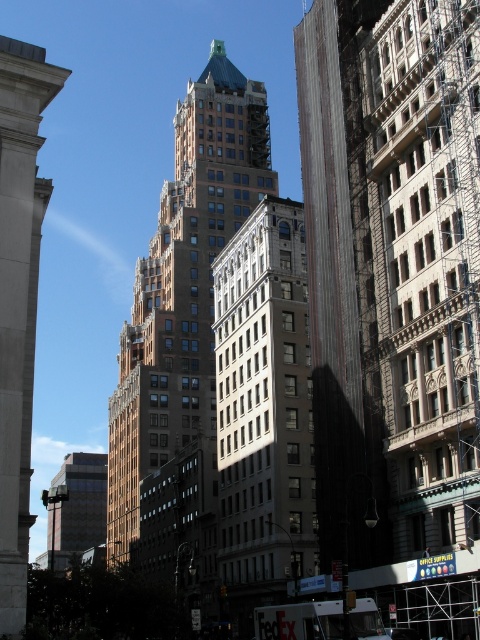
Is point (160, 208) positioned after point (10, 442)?

Yes, it is behind point (10, 442).

Measure the distance from brown stone tower at center to white stone column at left.

The distance of brown stone tower at center from white stone column at left is 263.17 feet.

Find the location of a particular element. The image size is (480, 640). brown stone tower at center is located at coordinates (182, 285).

Which is below, white stone building at center or white stone column at left?

Positioned lower is white stone building at center.

Is white stone building at center closer to camera compared to white stone column at left?

No, white stone building at center is behind white stone column at left.

Does point (252, 520) lie in front of point (27, 522)?

No, (252, 520) is behind (27, 522).

I want to click on white stone building at center, so click(264, 408).

Is point (360, 8) positioned in front of point (82, 524)?

Yes, point (360, 8) is in front of point (82, 524).

Which of these two, dark brown brick building at center or glassy reflective building at center, stands taller?

With more height is glassy reflective building at center.

Is point (324, 61) closer to viewer compared to point (100, 490)?

Yes.

Locate an element on the screen. The height and width of the screenshot is (640, 480). dark brown brick building at center is located at coordinates (340, 284).